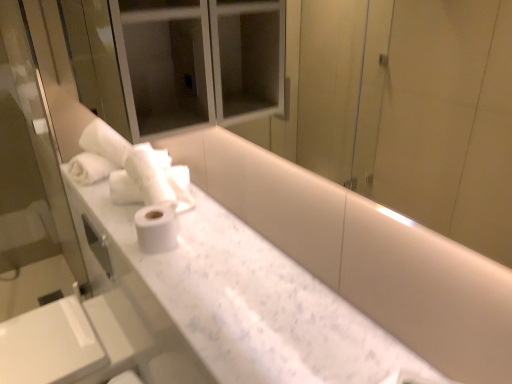
Identify the location of free space above white marble sink at lower left (from a real-world perspective). (40, 337).